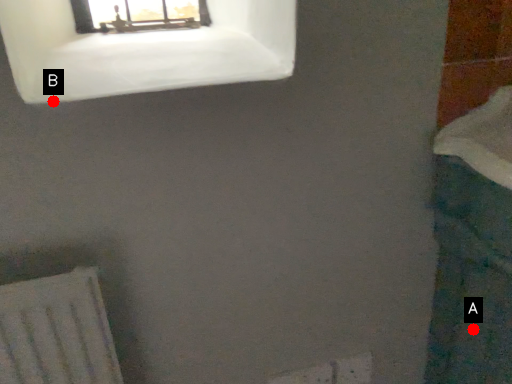
Question: Two points are circled on the image, labeled by A and B beside each circle. Which point is further to the camera?

Choices:
 (A) A is further
 (B) B is further

Answer: (A)